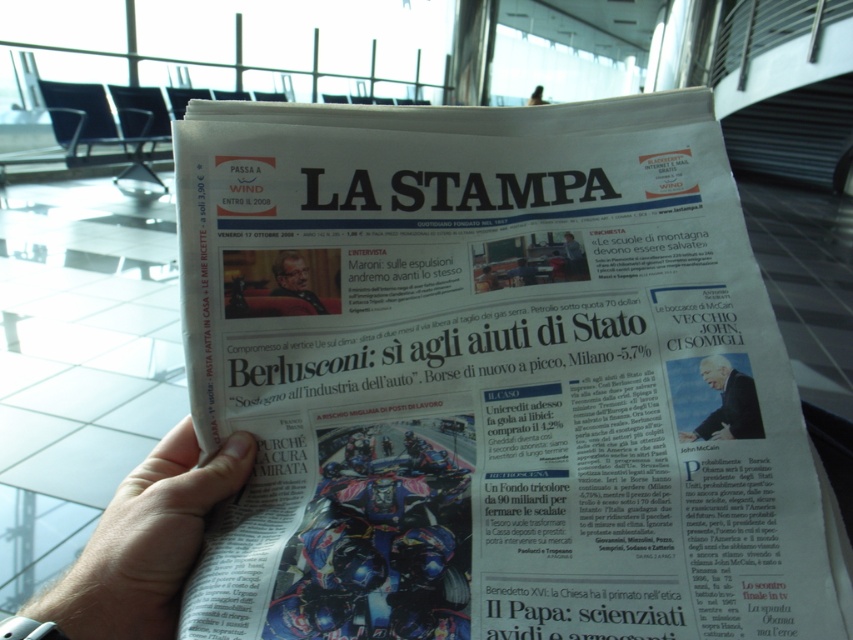
You are a graphic designer working on a layout for a new advertisement. You need to place a new element between two points on the newspaper layout. The points are point 1 at position (178, 582) and point 2 at position (757, 432). Based on the newspaper layout described, which point is closer to the front of the newspaper?

Point 2 at position (757, 432) is closer to the front of the newspaper because it is in front of point 1 at position (178, 582) according to the spatial relationship provided.

You are a photographer trying to capture a clear photo of the white glossy newspaper at center. The camera you are using has a minimum focusing distance of 12 inches. Can you take the photo without moving closer than 12 inches?

The white glossy newspaper at center is 13.07 inches away, which is beyond the camera minimum focusing distance of 12 inches. Therefore, you can take the photo without moving closer than 12 inches.